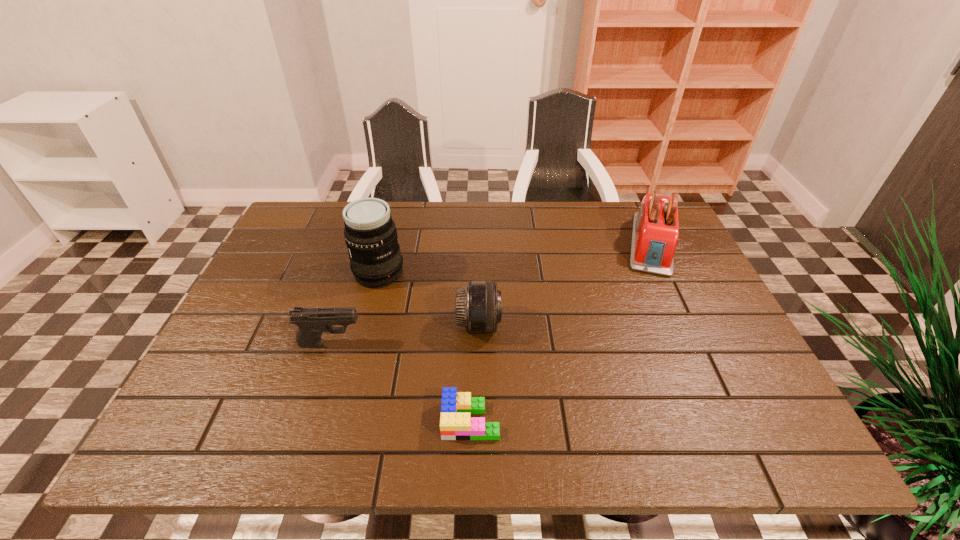
Find the location of a particular element. This screenshot has height=540, width=960. vacant region between the rightmost object and the shorter telephoto lens is located at coordinates (565, 284).

This screenshot has height=540, width=960. I want to click on vacant point located between the toaster and the shortest object, so click(562, 332).

Where is `object that is the third nearest to the shorter telephoto lens`? object that is the third nearest to the shorter telephoto lens is located at coordinates (311, 322).

Identify which object is the third closest to the nearer telephoto lens. Please provide its 2D coordinates. Your answer should be formatted as a tuple, i.e. [(x, y)], where the tuple contains the x and y coordinates of a point satisfying the conditions above.

[(311, 322)]

Where is `free location that satisfies the following two spatial constraints: 1. on the back side of the shortest object; 2. on the right side of the toaster`? This screenshot has width=960, height=540. free location that satisfies the following two spatial constraints: 1. on the back side of the shortest object; 2. on the right side of the toaster is located at coordinates (474, 244).

This screenshot has height=540, width=960. I want to click on free space that satisfies the following two spatial constraints: 1. at the barrel of the pistol; 2. on the left side of the shortest object, so click(306, 420).

Find the location of `vacant space that satisfies the following two spatial constraints: 1. on the front side of the fourth shortest object; 2. at the barrel of the pistol`. vacant space that satisfies the following two spatial constraints: 1. on the front side of the fourth shortest object; 2. at the barrel of the pistol is located at coordinates (698, 343).

Locate an element on the screen. The image size is (960, 540). vacant point that satisfies the following two spatial constraints: 1. on the front side of the left telephoto lens; 2. at the barrel of the pistol is located at coordinates (361, 343).